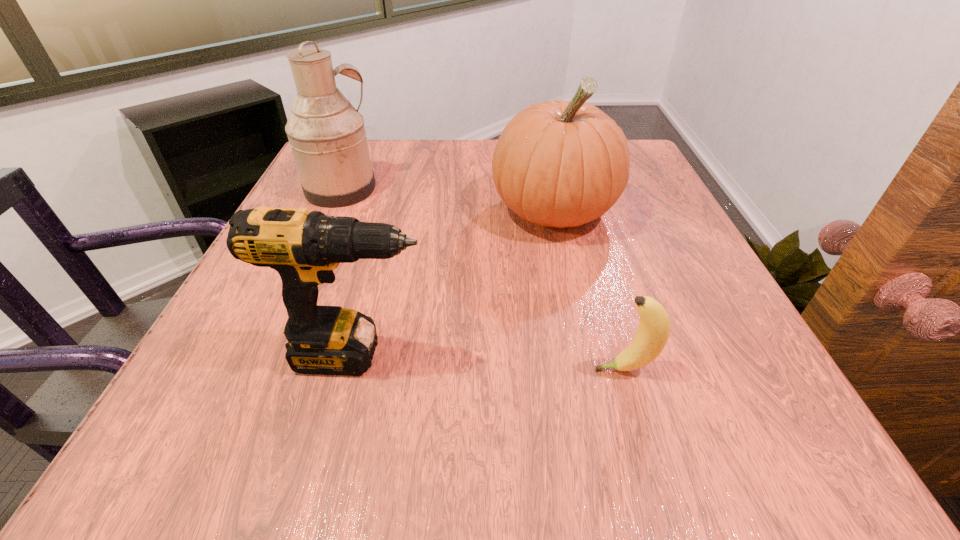
You are a GUI agent. You are given a task and a screenshot of the screen. Output one action in this format:
    pyautogui.click(x=<x>, y=<y>)
    Task: Click on the pitcher at the far edge
    The image size is (960, 540).
    Given the screenshot: What is the action you would take?
    pyautogui.click(x=327, y=136)

Identify the location of pumpkin at the far edge. Image resolution: width=960 pixels, height=540 pixels. (559, 164).

Where is `pitcher that is at the left edge`? This screenshot has width=960, height=540. pitcher that is at the left edge is located at coordinates (327, 136).

The image size is (960, 540). In order to click on drill that is at the left edge in this screenshot , I will do `click(304, 247)`.

You are a GUI agent. You are given a task and a screenshot of the screen. Output one action in this format:
    pyautogui.click(x=<x>, y=<y>)
    Task: Click on the object positioned at the right edge
    
    Given the screenshot: What is the action you would take?
    pyautogui.click(x=559, y=164)

This screenshot has height=540, width=960. In order to click on object located in the far left corner section of the desktop in this screenshot , I will do `click(327, 136)`.

Where is `object situated at the far right corner`? object situated at the far right corner is located at coordinates 559,164.

Where is `free space at the far edge of the desktop`? The image size is (960, 540). free space at the far edge of the desktop is located at coordinates (489, 181).

What are the coordinates of `free location at the right edge of the desktop` in the screenshot? It's located at (713, 368).

I want to click on free spot at the far left corner of the desktop, so click(378, 155).